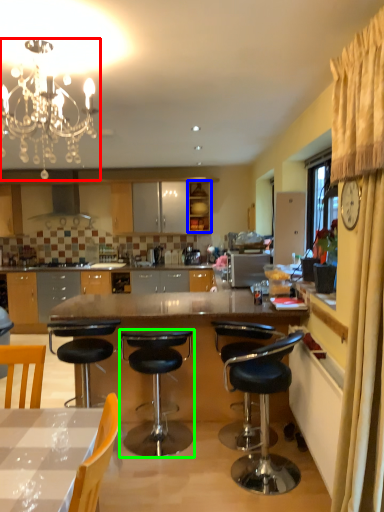
Question: Which object is positioned farthest from light fixture (highlighted by a red box)? Select from cabinetry (highlighted by a blue box) and chair (highlighted by a green box).

Choices:
 (A) cabinetry
 (B) chair

Answer: (A)